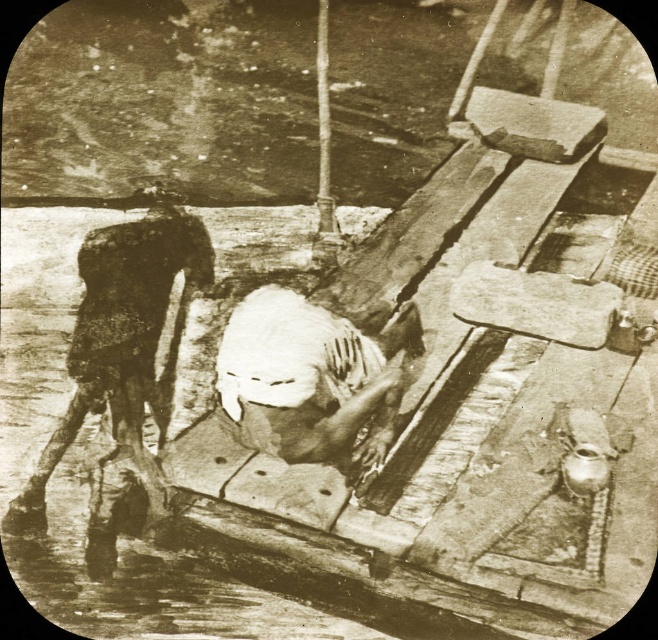
You are observing a historical photograph from the late 19th or early 20th century. In the image, there is a rusty metal man at left and a white clothed figure at center. Which of these two figures is located more to the left side of the image?

The rusty metal man at left is positioned on the left side of the white clothed figure at center, so the rusty metal man at left is more to the left.